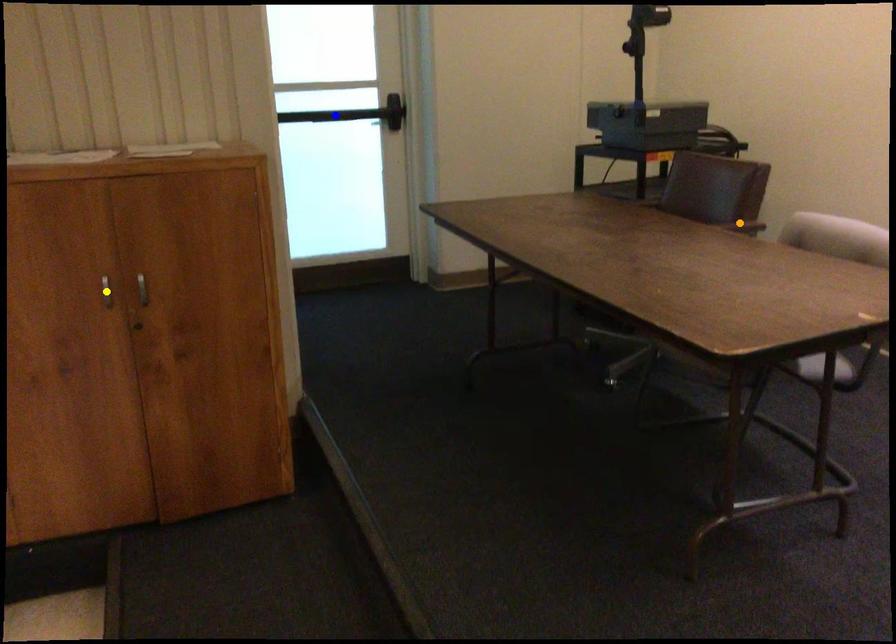
Order these from nearest to farthest:
A) yellow point
B) orange point
C) blue point

blue point → orange point → yellow point